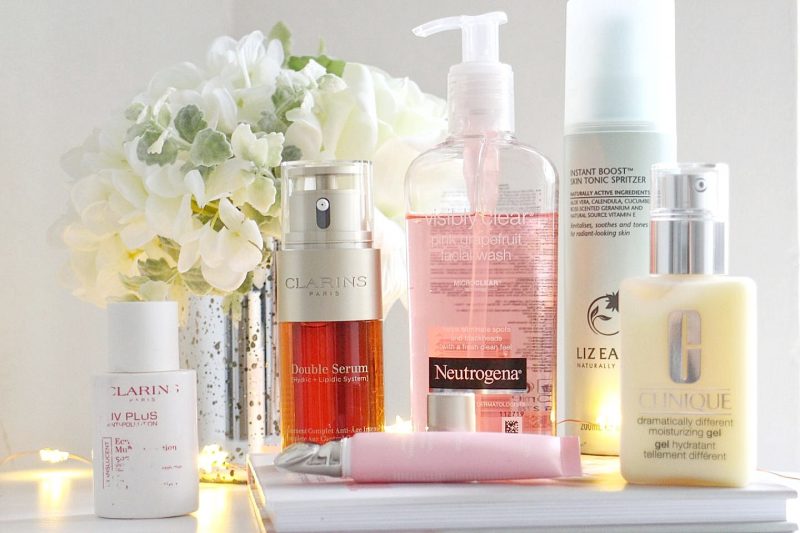
Locate an element on the screen. Image resolution: width=800 pixels, height=533 pixels. pages of book is located at coordinates (749, 513).